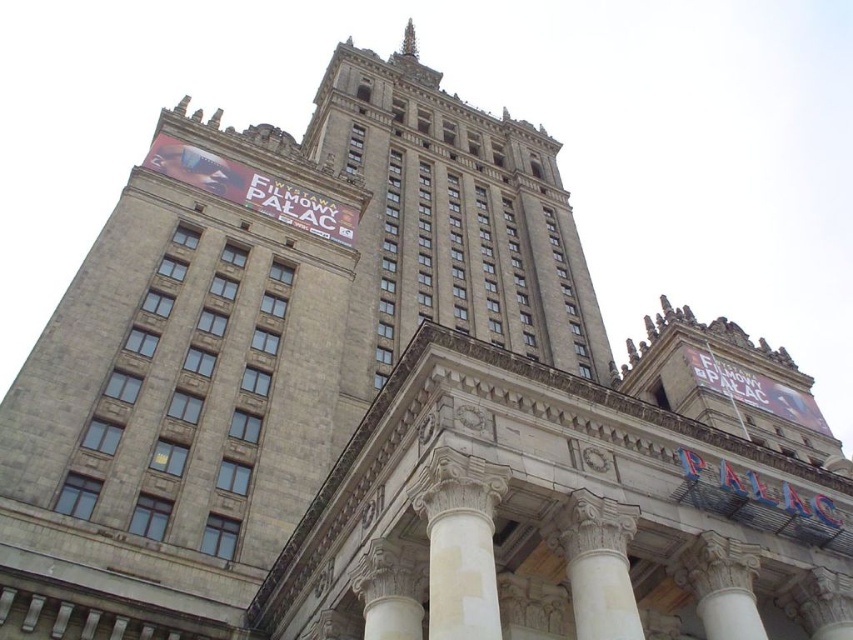
You are standing at a point 33.02 meters away from the point marked as point (561, 534). Given that the building is 50 meters tall, can you estimate whether the point is located on the upper section of the building or the lower section?

The point (561, 534) is located on the upper section of the building since it is 33.02 meters away from the viewer, and the building is 50 meters tall. The distance from the viewer to the point suggests it is positioned higher up compared to the lower sections.

You are standing in front of the grand building and notice two white marble structures at the center. Which one is closer to you, the white marble column at center or the white marble pillar at center?

The white marble column at center is closer to you as it is in front of the white marble pillar at center.

You are standing in front of the grand building and notice a specific point marked at coordinates (596, 564). Based on the scene description, what object is located at this point?

The point at coordinates (596, 564) corresponds to the white marble column at center.